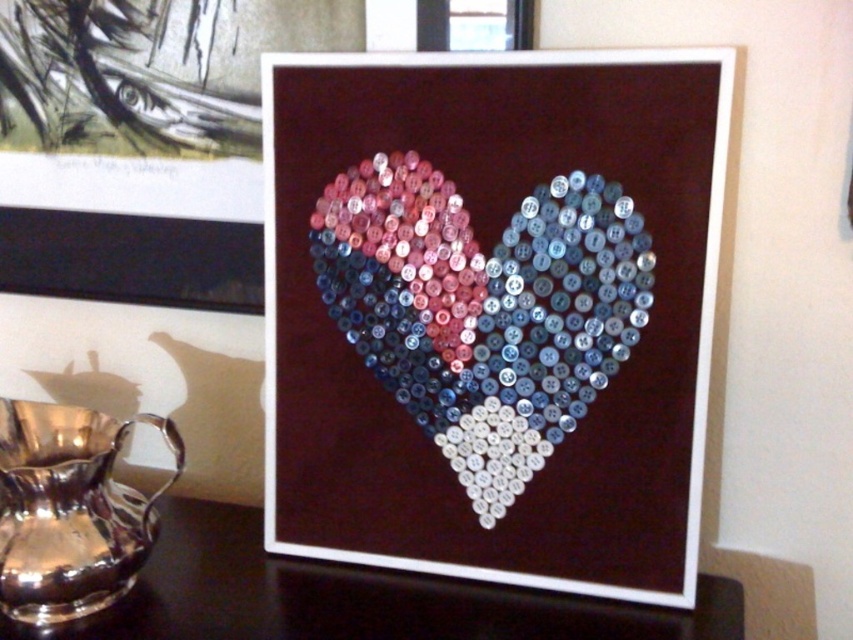
Which is more to the left, black glossy table at center or shiny silver pitcher at lower left?

From the viewer's perspective, shiny silver pitcher at lower left appears more on the left side.

Identify the location of black glossy table at center. This screenshot has height=640, width=853. (352, 596).

Does point (279, 397) come behind point (465, 614)?

Yes.

Who is positioned more to the left, shiny plastic heart at center or black glossy table at center?

black glossy table at center is more to the left.

Is point (688, 291) closer to camera compared to point (329, 605)?

Yes, point (688, 291) is in front of point (329, 605).

This screenshot has width=853, height=640. I want to click on shiny plastic heart at center, so click(633, 365).

The width and height of the screenshot is (853, 640). Describe the element at coordinates (633, 365) in the screenshot. I see `shiny plastic heart at center` at that location.

Between point (570, 61) and point (57, 404), which one is positioned behind?

Positioned behind is point (57, 404).

Identify the location of shiny plastic heart at center. This screenshot has width=853, height=640. (633, 365).

Locate an element on the screen. shiny plastic heart at center is located at coordinates (633, 365).